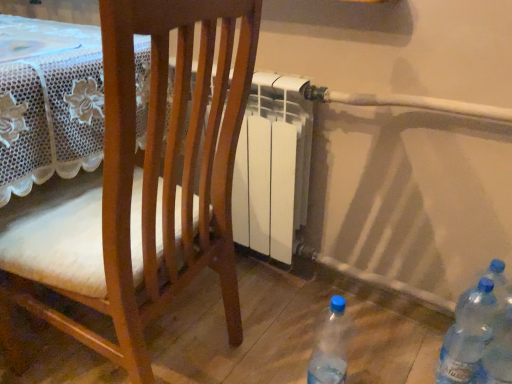
Find the location of a particular element. free space to the left of transparent plastic bottle at lower right, which appears as the 3th bottle when viewed from the right is located at coordinates (248, 366).